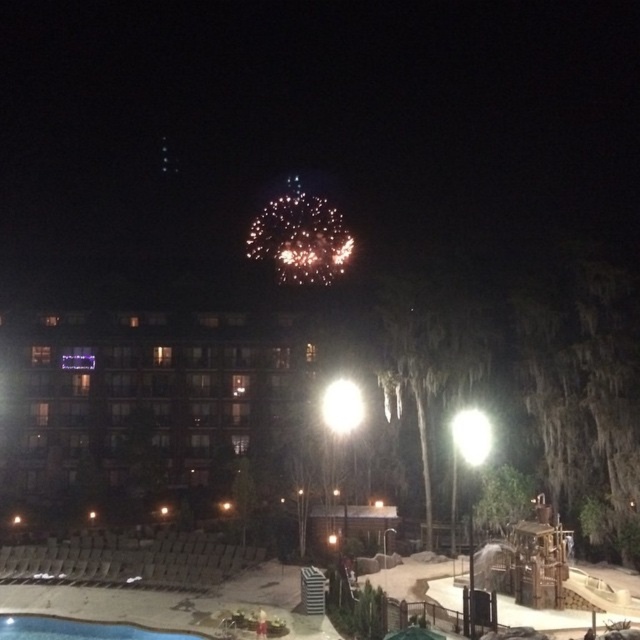
Can you confirm if matte glass hotel at center is shorter than blue smooth pool at lower left?

No.

Which is above, matte glass hotel at center or blue smooth pool at lower left?

matte glass hotel at center

Where is `matte glass hotel at center`? This screenshot has height=640, width=640. matte glass hotel at center is located at coordinates (145, 401).